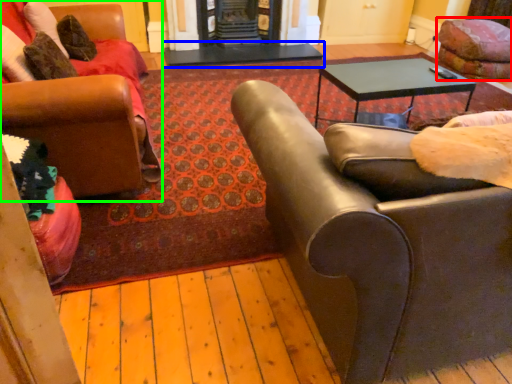
Question: Considering the real-world distances, which object is closest to swivel chair (highlighted by a red box)? table (highlighted by a blue box) or chair (highlighted by a green box).

Choices:
 (A) table
 (B) chair

Answer: (A)